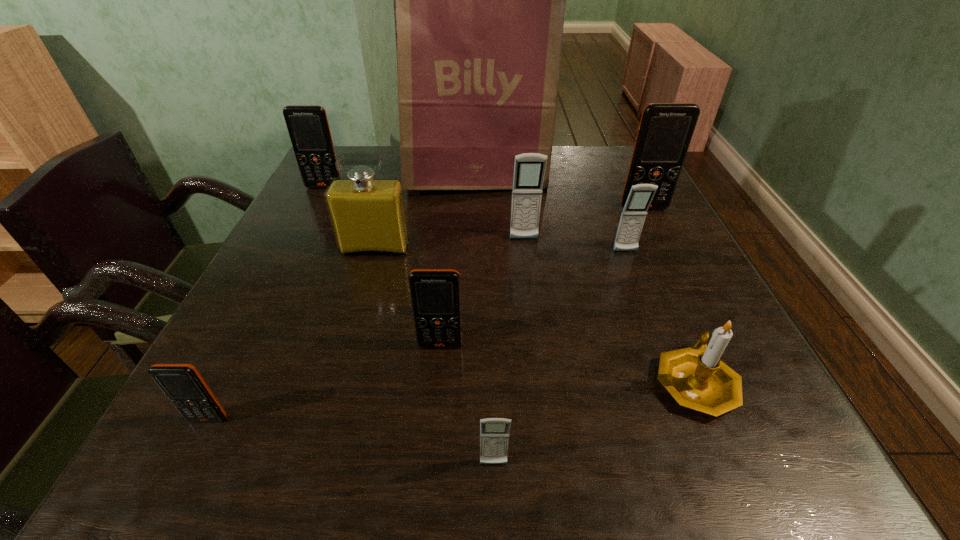
Locate an element on the screen. candle holder that is at the right edge is located at coordinates (697, 379).

This screenshot has width=960, height=540. What are the coordinates of `object that is at the far left corner` in the screenshot? It's located at (308, 127).

Locate an element on the screen. The width and height of the screenshot is (960, 540). object situated at the near left corner is located at coordinates (182, 383).

The height and width of the screenshot is (540, 960). In order to click on object situated at the near right corner in this screenshot , I will do `click(697, 379)`.

The height and width of the screenshot is (540, 960). I want to click on vacant space at the far edge, so click(x=557, y=150).

Locate an element on the screen. The width and height of the screenshot is (960, 540). free space at the near edge of the desktop is located at coordinates (338, 430).

Locate an element on the screen. Image resolution: width=960 pixels, height=540 pixels. vacant space at the left edge is located at coordinates (320, 211).

Where is `vacant space at the right edge`? This screenshot has width=960, height=540. vacant space at the right edge is located at coordinates (663, 265).

Image resolution: width=960 pixels, height=540 pixels. In the image, there is a desktop. What are the coordinates of `vacant space at the near left corner` in the screenshot? It's located at (186, 463).

This screenshot has width=960, height=540. Find the location of `empty location between the second nearest cellular telephone and the perfume`. empty location between the second nearest cellular telephone and the perfume is located at coordinates (292, 334).